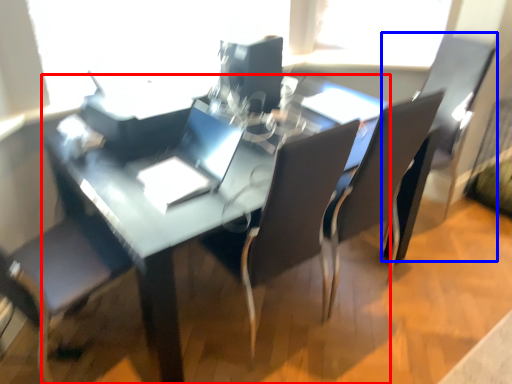
Question: Among these objects, which one is nearest to the camera, table (highlighted by a red box) or armchair (highlighted by a blue box)?

Choices:
 (A) table
 (B) armchair

Answer: (A)